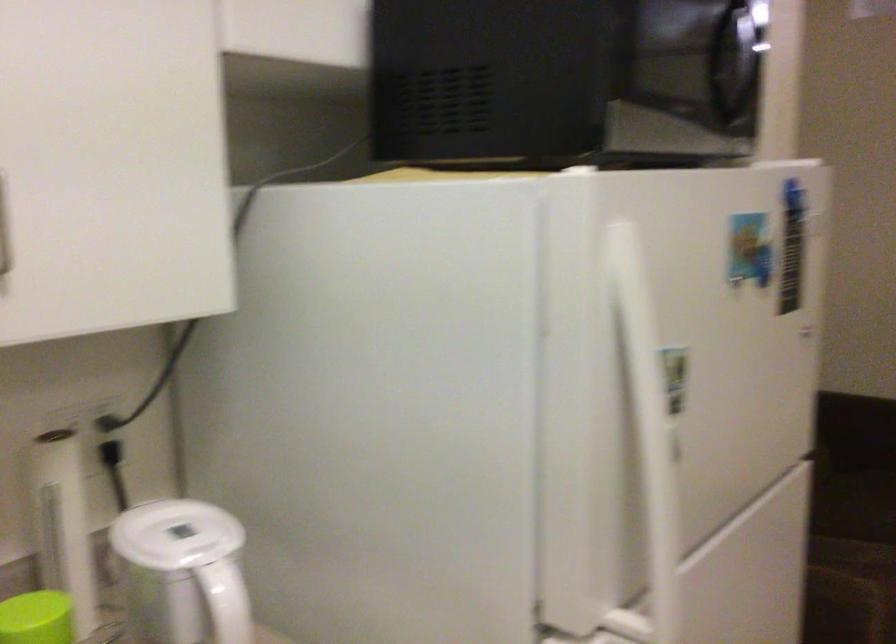
The image size is (896, 644). What do you see at coordinates (37, 618) in the screenshot?
I see `the green plastic lid` at bounding box center [37, 618].